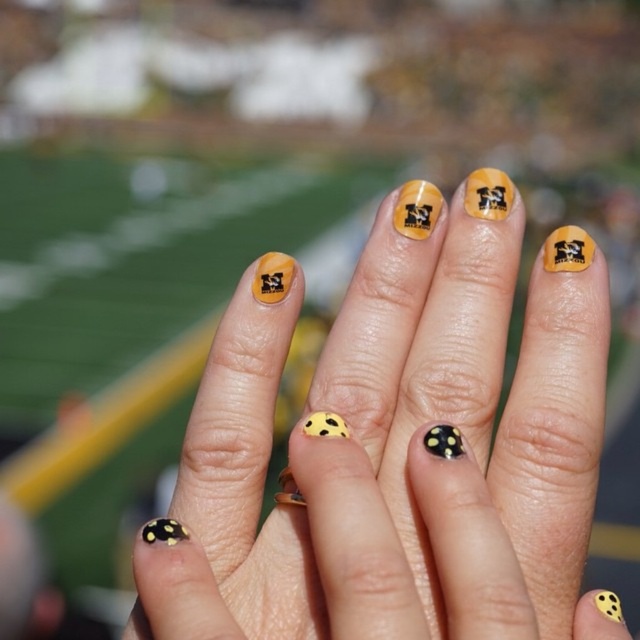
From the picture: You are a photographer trying to capture the yellow matte nail art at center in your shot. Based on the coordinates provided, can you confirm if the nail art is located in the lower half of the image?

The yellow matte nail art at center is located at coordinates point (x=396, y=456). Since the y coordinate is 0.620, which is above 0.5, it is in the upper half of the image. Therefore, the nail art is not in the lower half of the image.

Looking at this image, you are a manicurist preparing to apply a new design on a client. The client wants to know if the yellow matte nail art at center will cover the existing yellow matte polka dot at center. Can you determine this based on their positions?

The yellow matte nail art at center is positioned under the yellow matte polka dot at center, so applying the new design would cover the existing polka dot.

You are a photographer editing a closeup photo of hands with nail art. You need to adjust the focus to highlight the yellow matte nail art at center and the yellow matte polka dot at center. Which one should you focus on if you want the design to the right to be sharp?

You should focus on the yellow matte nail art at center because it is to the right of the yellow matte polka dot at center, so adjusting focus there will ensure the rightmost design is sharp.